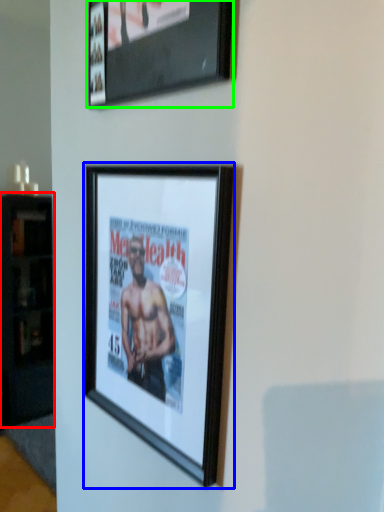
Question: Estimate the real-world distances between objects in this image. Which object is farther from cabinetry (highlighted by a red box), picture frame (highlighted by a blue box) or picture frame (highlighted by a green box)?

Choices:
 (A) picture frame
 (B) picture frame

Answer: (B)